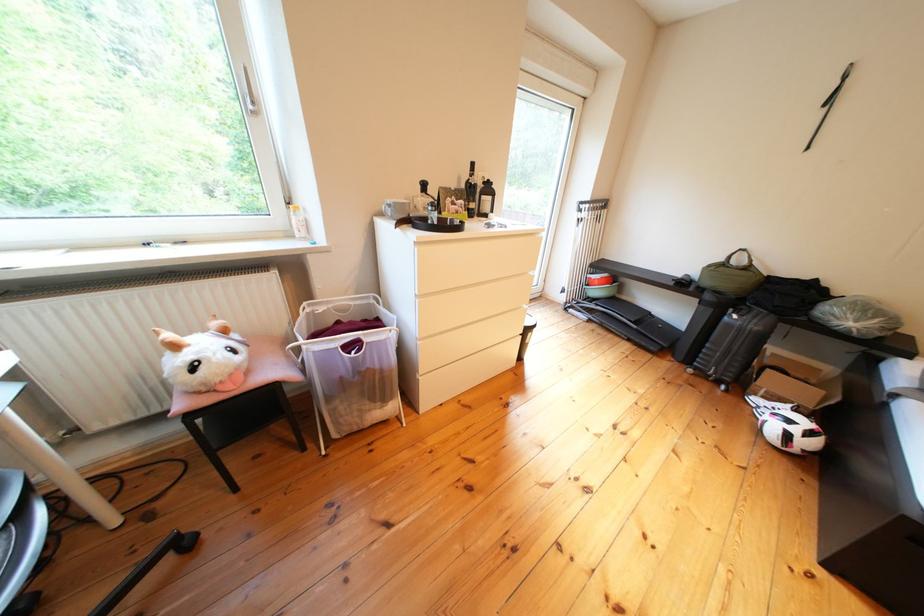
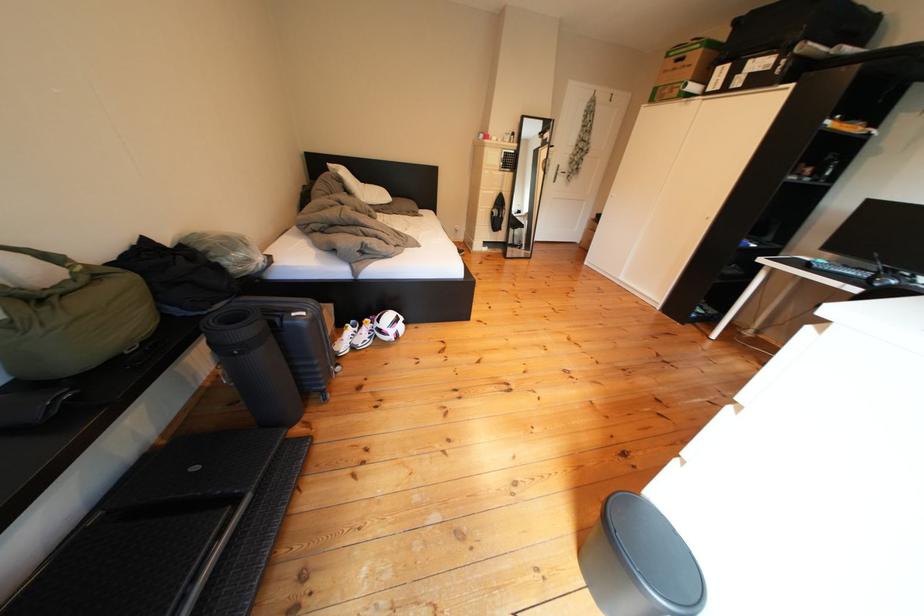
Find the pixel in the second image that matches point 748,322 in the first image.

(317, 318)